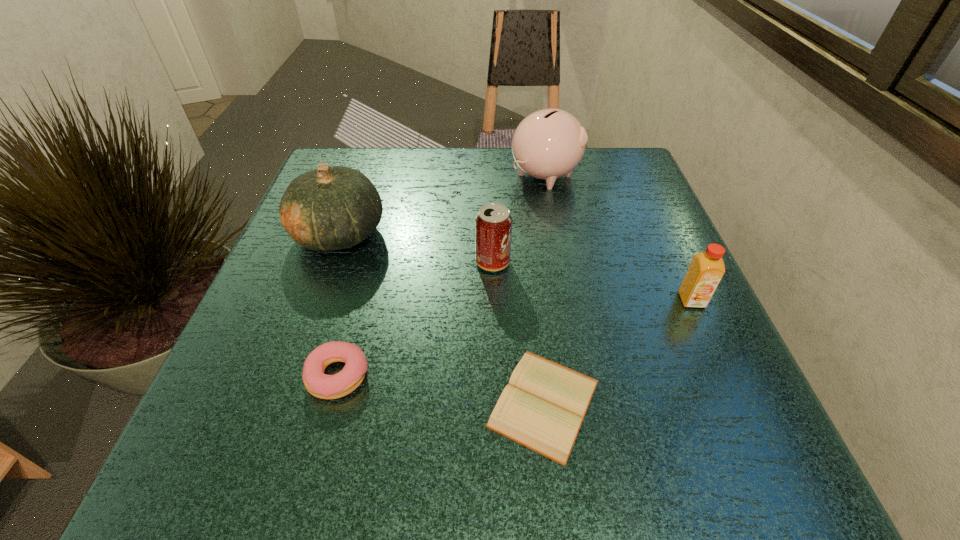
Locate an element on the screen. free space at the far edge of the desktop is located at coordinates (504, 172).

The height and width of the screenshot is (540, 960). I want to click on free space at the near edge, so click(x=656, y=471).

Locate an element on the screen. The width and height of the screenshot is (960, 540). free region at the left edge is located at coordinates (319, 343).

Image resolution: width=960 pixels, height=540 pixels. In the image, there is a desktop. In order to click on vacant space at the right edge in this screenshot , I will do `click(629, 215)`.

In the image, there is a desktop. Identify the location of vacant space at the far left corner. This screenshot has height=540, width=960. (364, 146).

This screenshot has height=540, width=960. I want to click on free space at the near right corner, so click(794, 484).

At what (x,y) coordinates should I click in order to perform the action: click on empty space between the soda can and the shortest object. Please return your answer as a coordinate pair (x, y). Image resolution: width=960 pixels, height=540 pixels. Looking at the image, I should click on (518, 333).

Identify the location of free space between the gourd and the soda can. (417, 248).

Where is `empty space that is in between the second shortest object and the rightmost object`? empty space that is in between the second shortest object and the rightmost object is located at coordinates (516, 338).

In order to click on unoccupied area between the soda can and the gourd in this screenshot , I will do `click(417, 248)`.